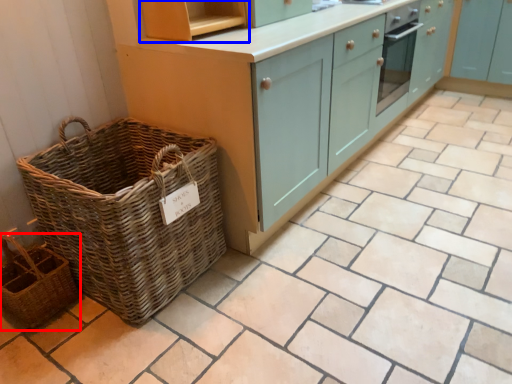
Question: Which of the following is the farthest to the observer, basket (highlighted by a red box) or shelf (highlighted by a blue box)?

Choices:
 (A) basket
 (B) shelf

Answer: (B)